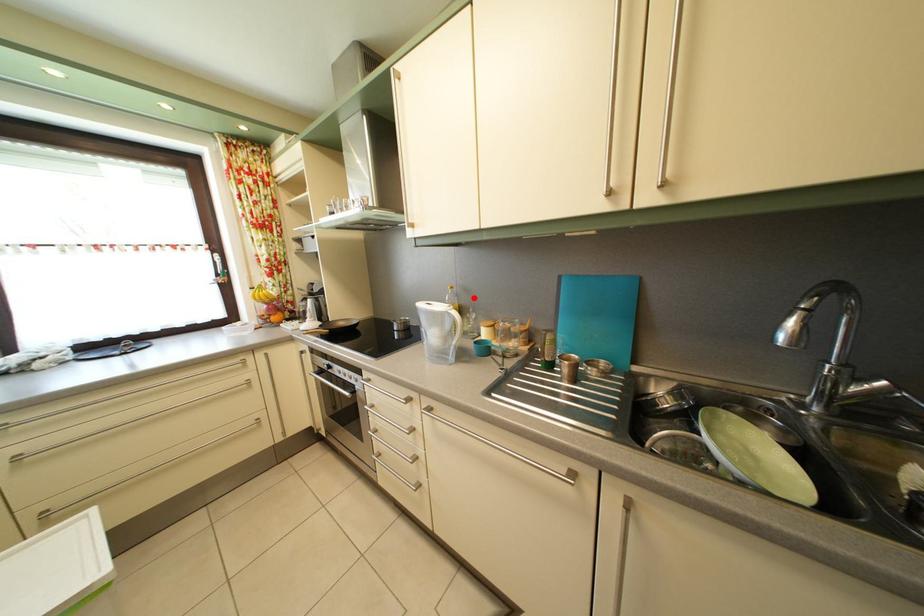
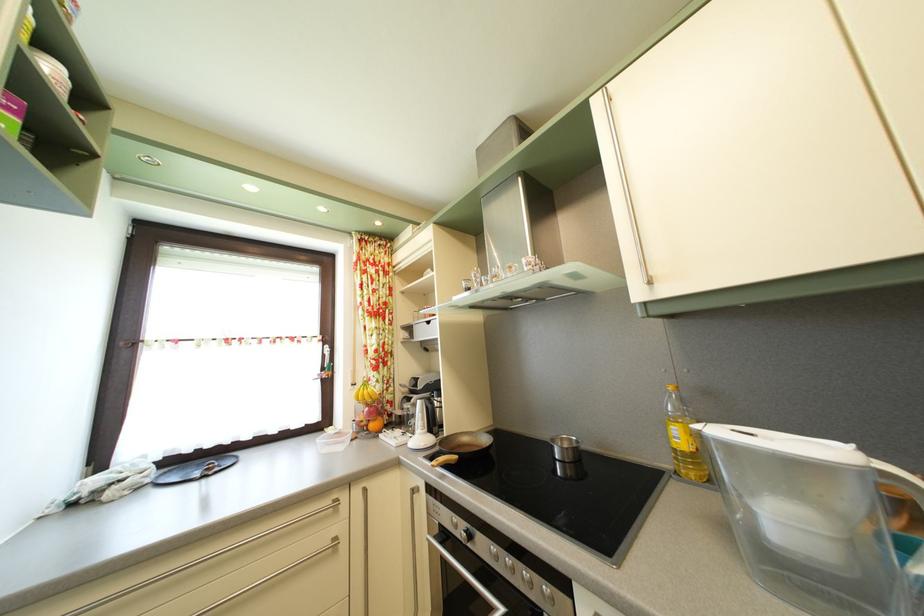
Find the pixel in the second image that matches the highlighted location in the first image.

(715, 400)